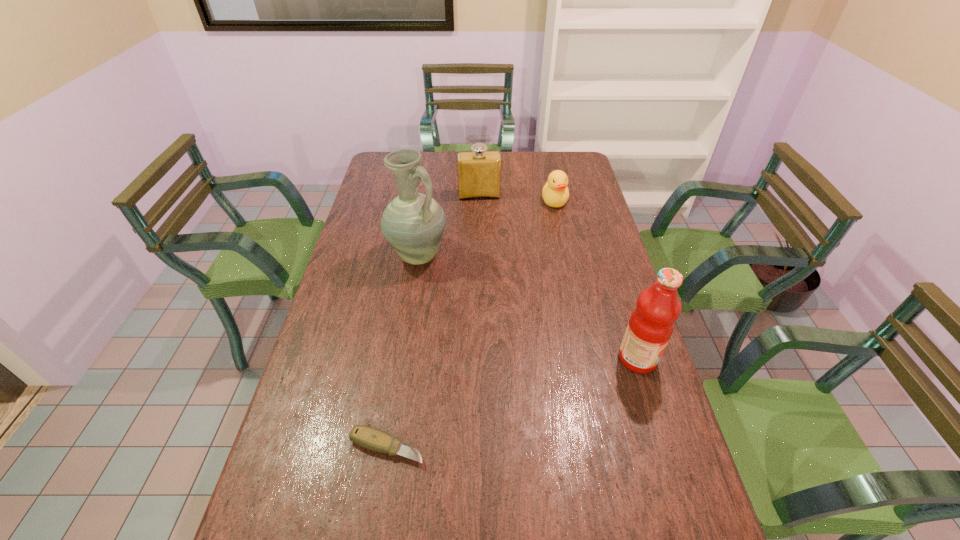
Locate an element on the screen. The height and width of the screenshot is (540, 960). the third closest object to the fourth farthest object is located at coordinates (555, 193).

Find the location of a particular element. The image size is (960, 540). the third closest object relative to the fourth object from left to right is located at coordinates (652, 322).

The image size is (960, 540). Identify the location of free space that satisfies the following two spatial constraints: 1. on the back side of the pocketknife; 2. on the front label of the rightmost object. (401, 359).

At what (x,y) coordinates should I click in order to perform the action: click on free space that satisfies the following two spatial constraints: 1. on the back side of the duck; 2. on the right side of the pocketknife. Please return your answer as a coordinate pair (x, y). The image size is (960, 540). Looking at the image, I should click on (425, 201).